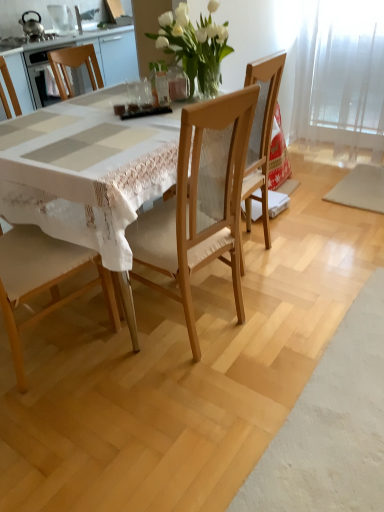
Where is `vacant area in front of transparent glass door at upper right`? This screenshot has height=512, width=384. vacant area in front of transparent glass door at upper right is located at coordinates (346, 176).